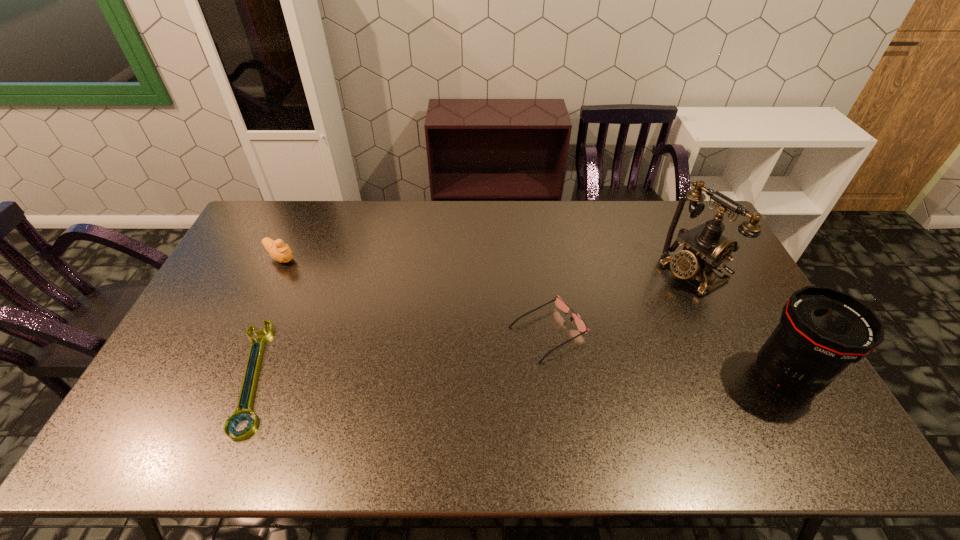
Locate an element on the screen. Image resolution: width=960 pixels, height=540 pixels. free space on the desktop that is between the wrench and the second tallest object and is positioned on the bridge of the sunglasses is located at coordinates (464, 376).

Find the location of a particular element. free space on the desktop that is between the wrench and the second tallest object and is positioned on the face of the third shortest object is located at coordinates (469, 376).

I want to click on free spot on the desktop that is between the shortest object and the telephoto lens and is positioned on the rotary dial of the telephone, so click(497, 376).